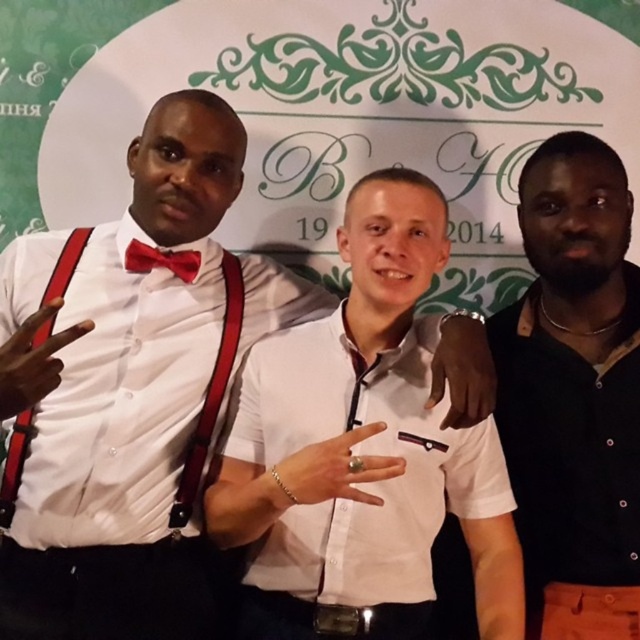
Image resolution: width=640 pixels, height=640 pixels. In order to click on black leather jacket at right in this screenshot , I will do `click(573, 392)`.

Can you confirm if black leather jacket at right is bigger than red satin bow tie at left?

Yes.

Between point (538, 228) and point (138, 269), which one is positioned in front?

Point (138, 269) is more forward.

Where is `black leather jacket at right`? black leather jacket at right is located at coordinates (573, 392).

Between white satin shirt at center and red leather suspenders at left, which one has more height?

white satin shirt at center is taller.

In the scene shown: Can you confirm if white satin shirt at center is wider than red leather suspenders at left?

Indeed, white satin shirt at center has a greater width compared to red leather suspenders at left.

Who is more distant from viewer, (132, 189) or (3, 509)?

The point (132, 189) is behind.

Where is `white satin shirt at center`? This screenshot has height=640, width=640. white satin shirt at center is located at coordinates (120, 401).

Is the position of white matte shirt at center less distant than that of black leather jacket at right?

Yes, white matte shirt at center is in front of black leather jacket at right.

Who is more forward, (324, 433) or (602, 177)?

Point (324, 433)

Image resolution: width=640 pixels, height=640 pixels. Identify the location of white matte shirt at center. (365, 442).